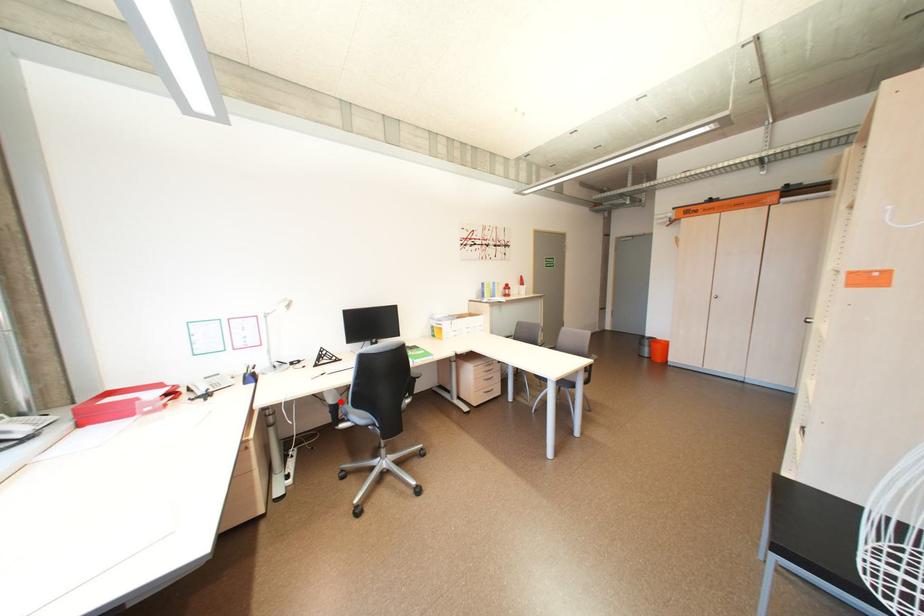
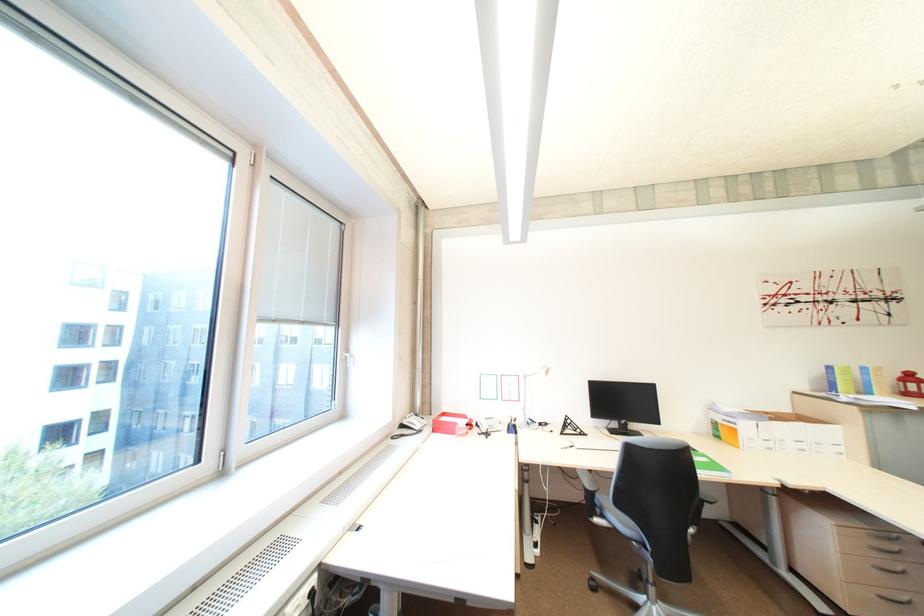
Question: I am providing you with two images of the same scene from different viewpoints. In image1, a red point is highlighted. Considering the same 3D point in image2, which of the following is correct?

Choices:
 (A) It is closer
 (B) It is farther

Answer: (A)